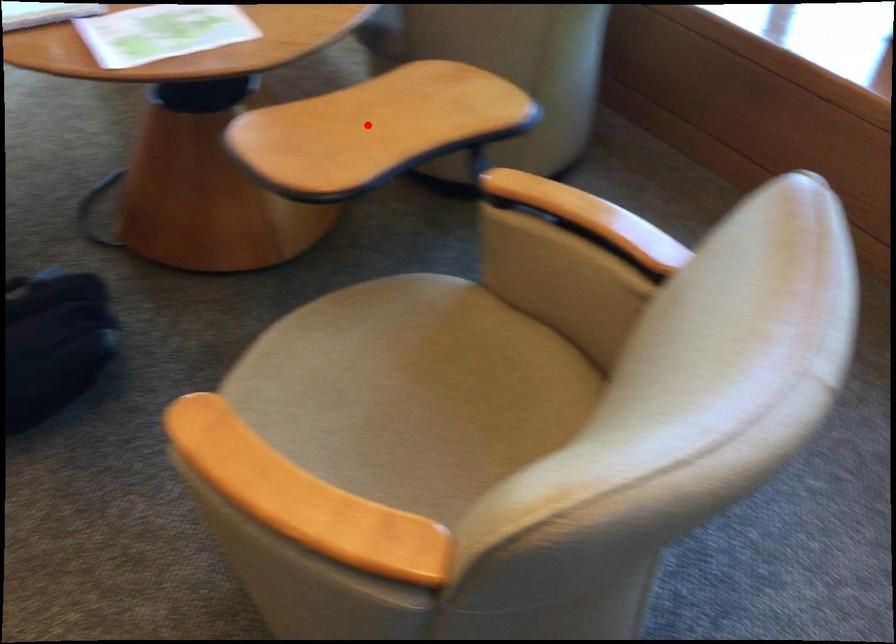
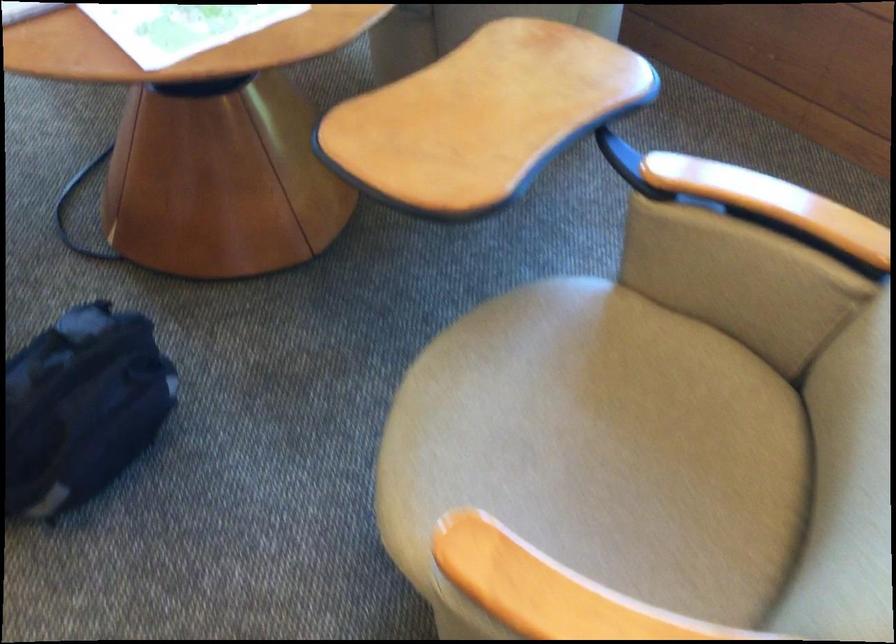
Question: I am providing you with two images of the same scene from different viewpoints. A red point is shown in image1. For the corresponding object point in image2, is it positioned nearer or farther from the camera?

Choices:
 (A) Nearer
 (B) Farther

Answer: (A)